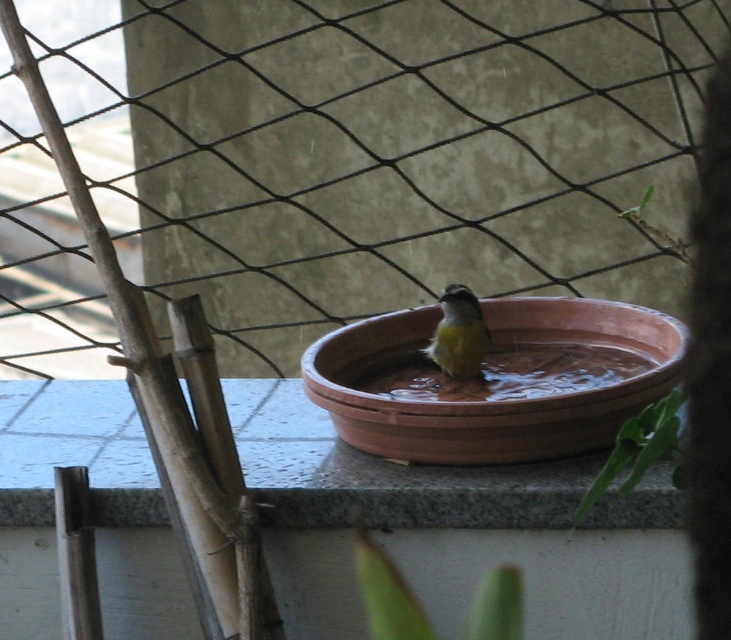
You are standing 1.5 meters away from the birdbath. Can you reach the point at coordinates point (610,378) without moving closer?

The point at coordinates point (610,378) is 1.60 meters from the viewer. Since you are standing 1.5 meters away from the birdbath, you are closer than the point, so you cannot reach it without moving further away.

You are a small insect trying to reach the green leafy plant at lower center from the clear water at center. Considering their sizes, can you fit through the space between them?

The clear water at center might be wider than green leafy plant at lower center, so the space between them is likely wide enough for the insect to pass through.